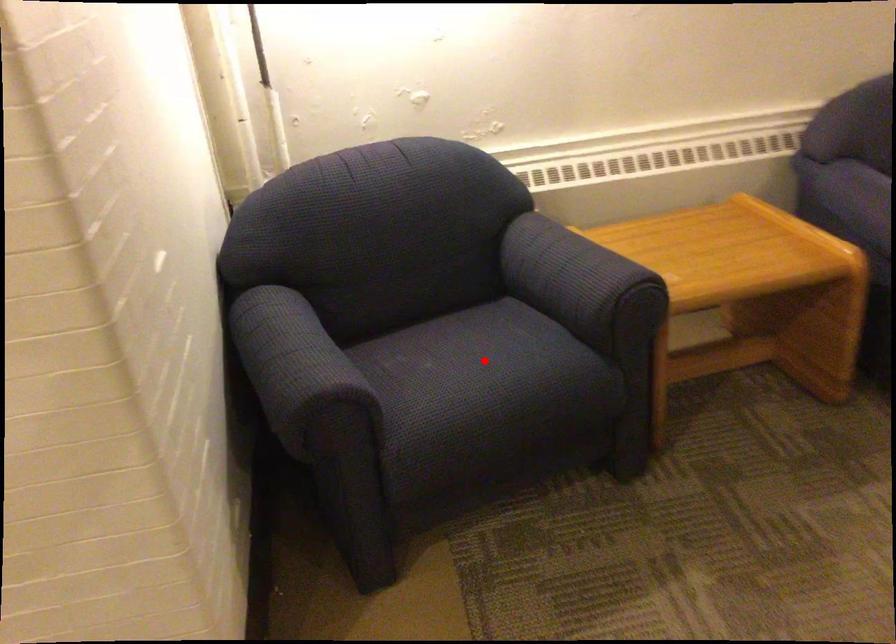
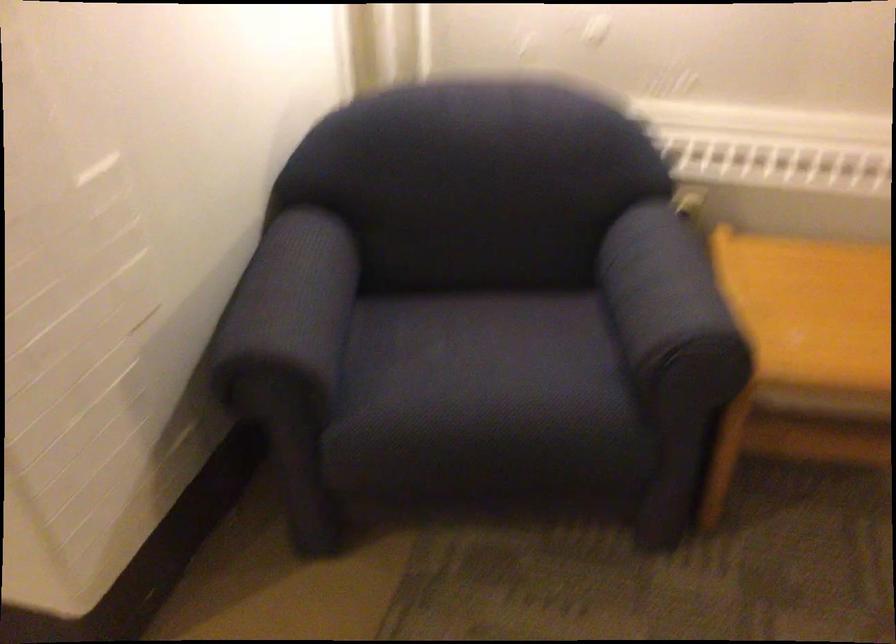
Question: I am providing you with two images of the same scene from different viewpoints. Given a red point in image1, look at the same physical point in image2. Is it:

Choices:
 (A) Closer to the viewpoint
 (B) Farther from the viewpoint

Answer: (A)